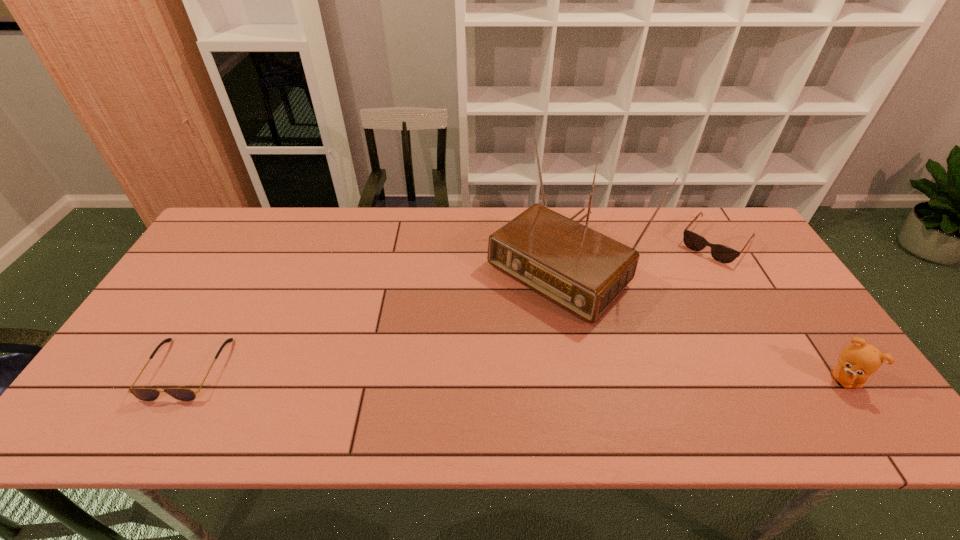
Find the location of a particular element. The height and width of the screenshot is (540, 960). vacant spot on the desktop that is between the leftmost object and the third shortest object and is positioned on the front panel of the second object from left to right is located at coordinates (431, 372).

Locate an element on the screen. free spot on the desktop that is between the nearer sunglasses and the teddy bear and is positioned at the front lenses of the farther sunglasses is located at coordinates (610, 375).